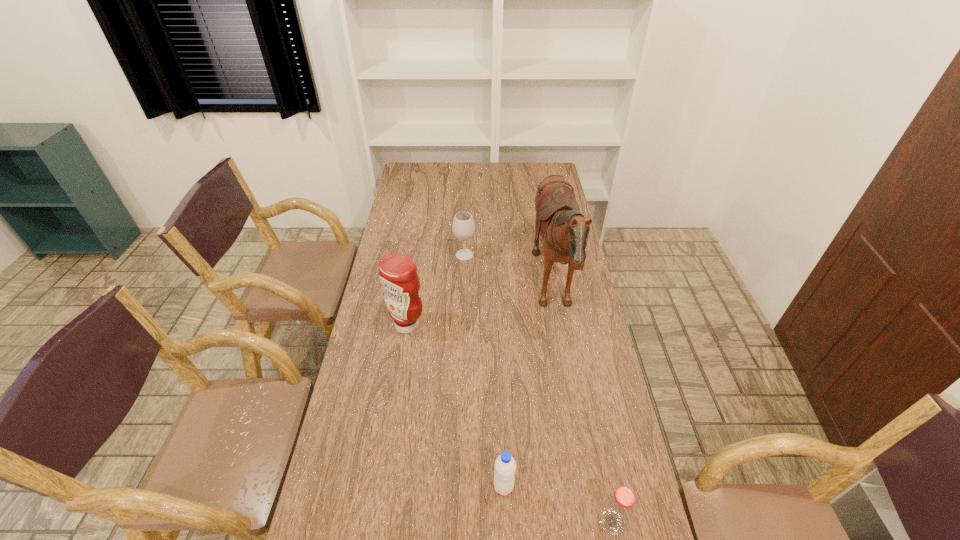
The image size is (960, 540). In order to click on the tallest object in this screenshot , I will do `click(564, 230)`.

Identify the location of condiment. The image size is (960, 540). (398, 275).

This screenshot has width=960, height=540. I want to click on the leftmost object, so click(x=398, y=275).

Locate an element on the screen. This screenshot has width=960, height=540. the fourth object from right to left is located at coordinates (463, 227).

At what (x,y) coordinates should I click in order to perform the action: click on the third object from right to left. Please return your answer as a coordinate pair (x, y). This screenshot has width=960, height=540. Looking at the image, I should click on (505, 466).

What are the coordinates of `the fourth farthest object` in the screenshot? It's located at (505, 466).

The height and width of the screenshot is (540, 960). I want to click on bottle, so click(617, 510).

Find the location of `vacant space situated on the back of the saddle`. vacant space situated on the back of the saddle is located at coordinates (429, 291).

Where is `free region located on the back of the saddle`? free region located on the back of the saddle is located at coordinates (437, 291).

I want to click on free location located on the back of the saddle, so click(498, 291).